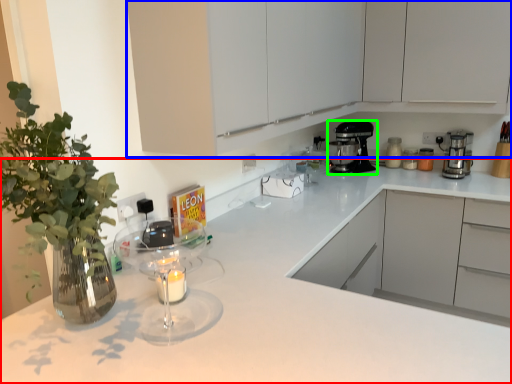
Question: Based on their relative distances, which object is nearer to countertop (highlighted by a red box)? Choose from cabinetry (highlighted by a blue box) and kitchen appliance (highlighted by a green box).

Choices:
 (A) cabinetry
 (B) kitchen appliance

Answer: (A)